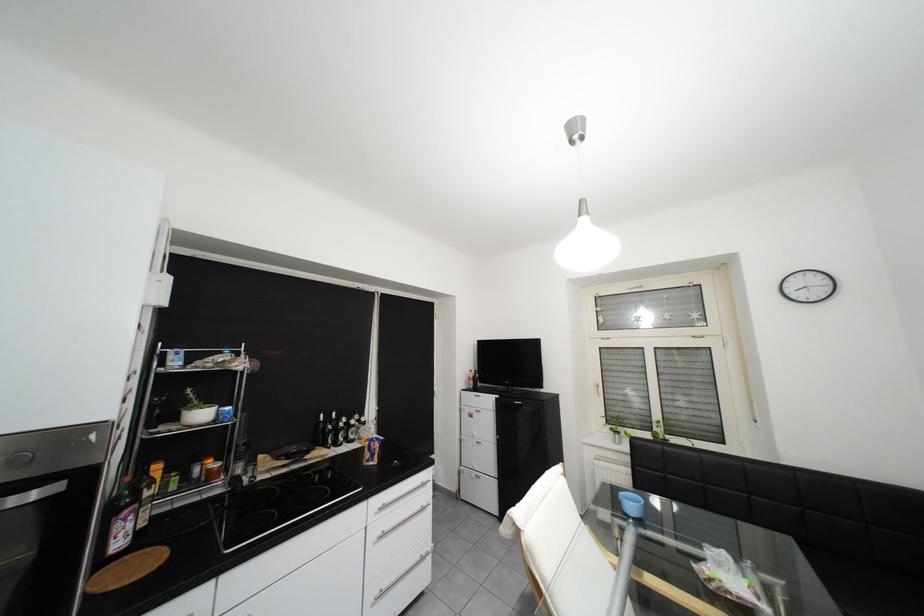
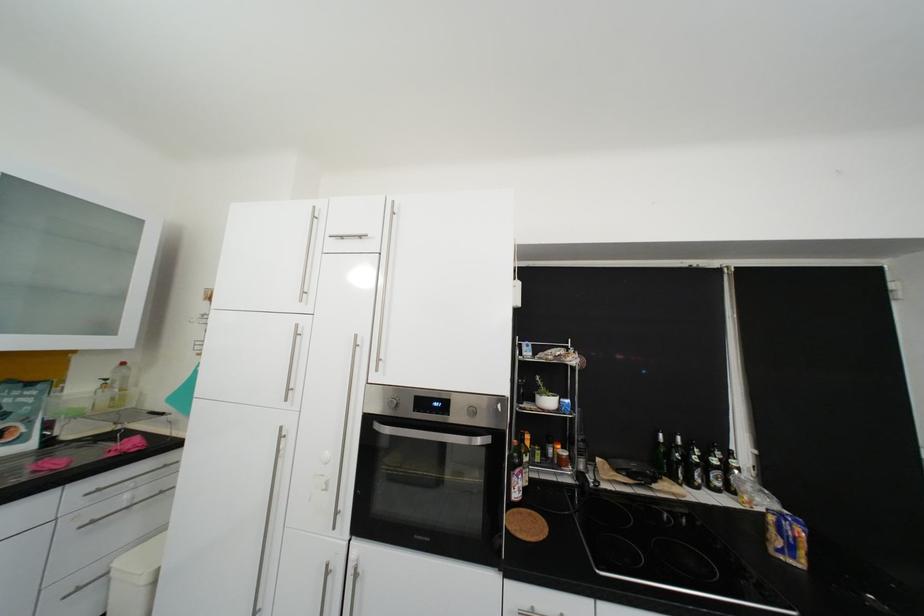
The point at (337, 428) is marked in the first image. Where is the corresponding point in the second image?

(682, 454)